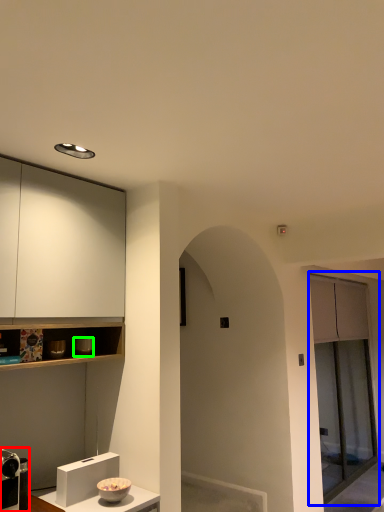
Question: Based on their relative distances, which object is farther from appliance (highlighted by a red box)? Choose from screen door (highlighted by a blue box) and appliance (highlighted by a green box).

Choices:
 (A) screen door
 (B) appliance

Answer: (A)